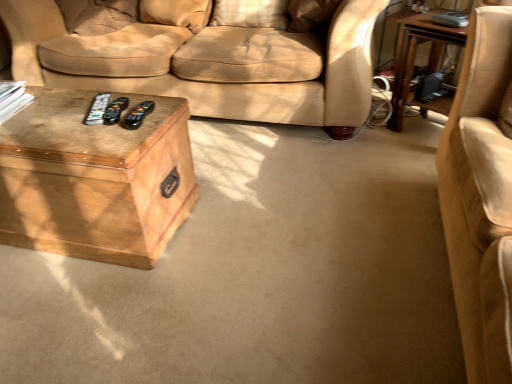
The width and height of the screenshot is (512, 384). I want to click on vacant space in front of wooden trunk at lower left, acting as the first table starting from the left, so click(x=87, y=304).